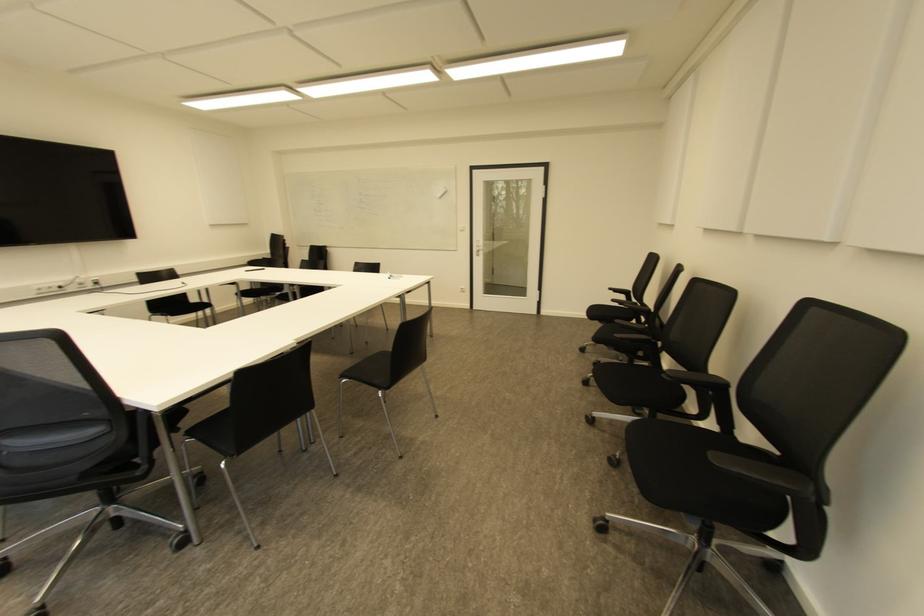
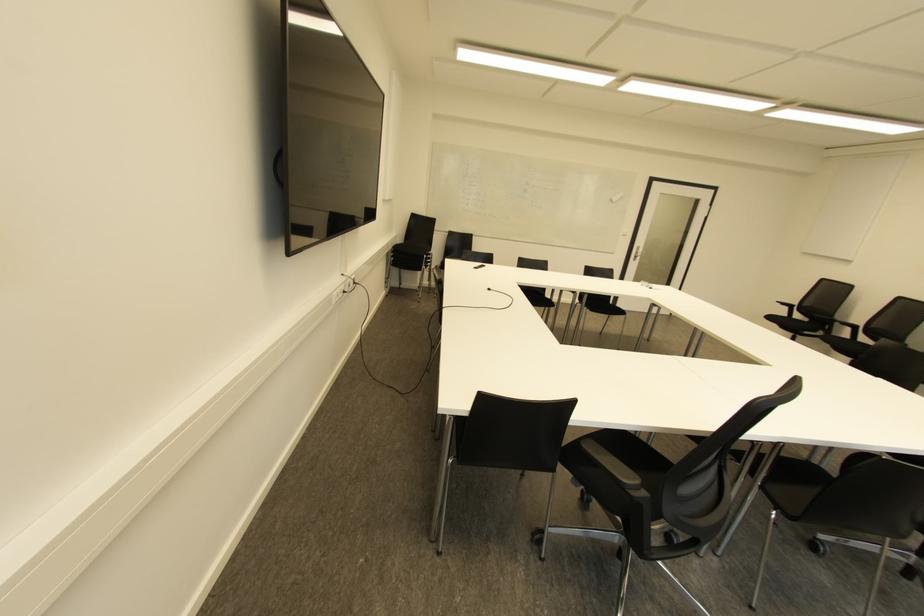
Where in the second image is the point corresponding to (96,282) from the first image?

(354, 282)